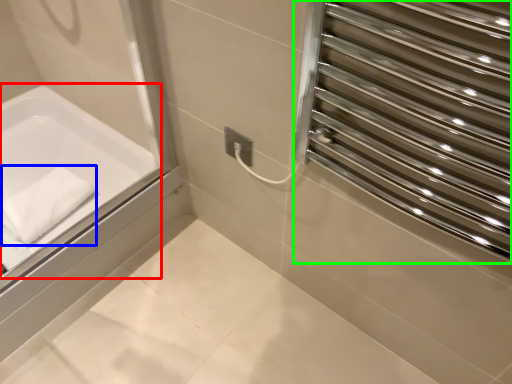
Question: Which object is the closest to the bathtub (highlighted by a red box)? Choose among these: bath towel (highlighted by a blue box) or screen door (highlighted by a green box).

Choices:
 (A) bath towel
 (B) screen door

Answer: (A)